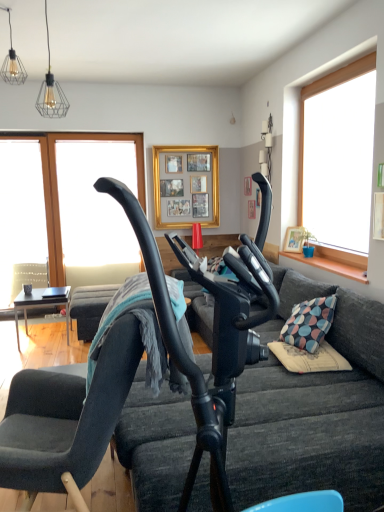
Question: From the image's perspective, is black matte table at left above or below transparent glass window at upper left, positioned as the 1th window screen in right-to-left order?

Choices:
 (A) below
 (B) above

Answer: (A)

Question: Is point (59, 295) positioned closer to the camera than point (92, 242)?

Choices:
 (A) farther
 (B) closer

Answer: (B)

Question: Based on their relative distances, which object is farther from the velvet dark gray chair at center?

Choices:
 (A) transparent glass window at upper left, which ranks as the second window screen in left-to-right order
 (B) dark gray fabric couch at center
 (C) gold/gilded picture frame at upper center
 (D) transparent glass window at left, marked as the second window screen in a right-to-left arrangement
 (E) black matte table at left

Answer: (C)

Question: Estimate the real-world distances between objects in this image. Which object is closer to the black matte table at left?

Choices:
 (A) dark gray fabric couch at center
 (B) transparent glass window at left, marked as the second window screen in a right-to-left arrangement
 (C) velvet dark gray chair at center
 (D) gold/gilded picture frame at upper center
 (E) transparent glass window at upper left, positioned as the 1th window screen in right-to-left order

Answer: (B)